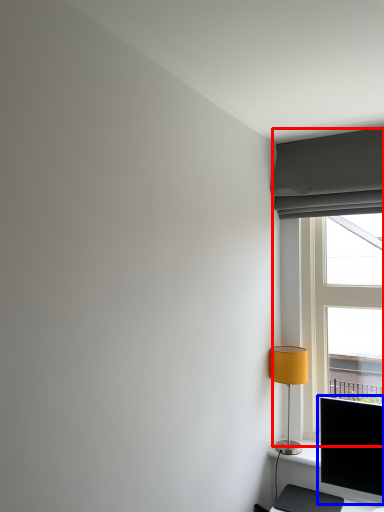
Question: Among these objects, which one is nearest to the camera, window (highlighted by a red box) or computer monitor (highlighted by a blue box)?

Choices:
 (A) window
 (B) computer monitor

Answer: (B)